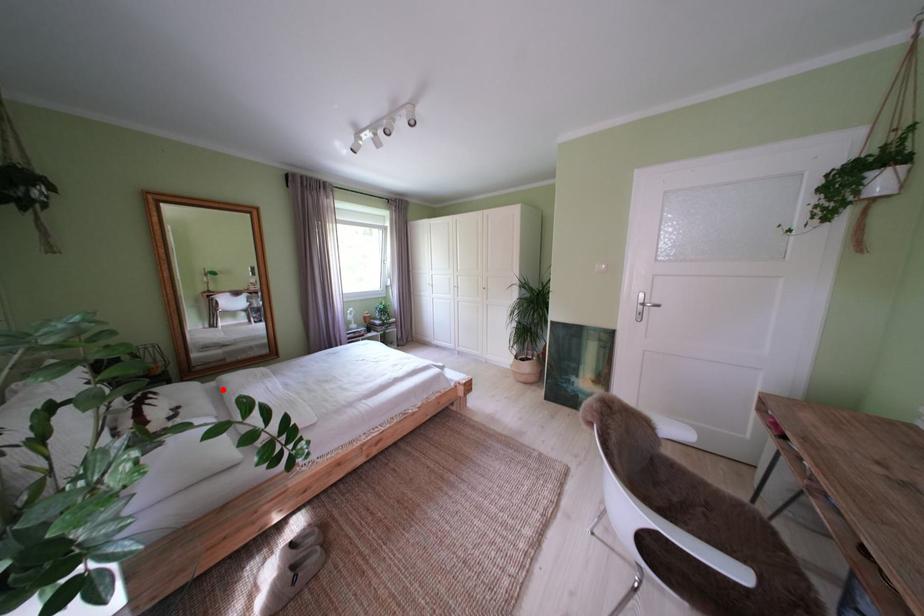
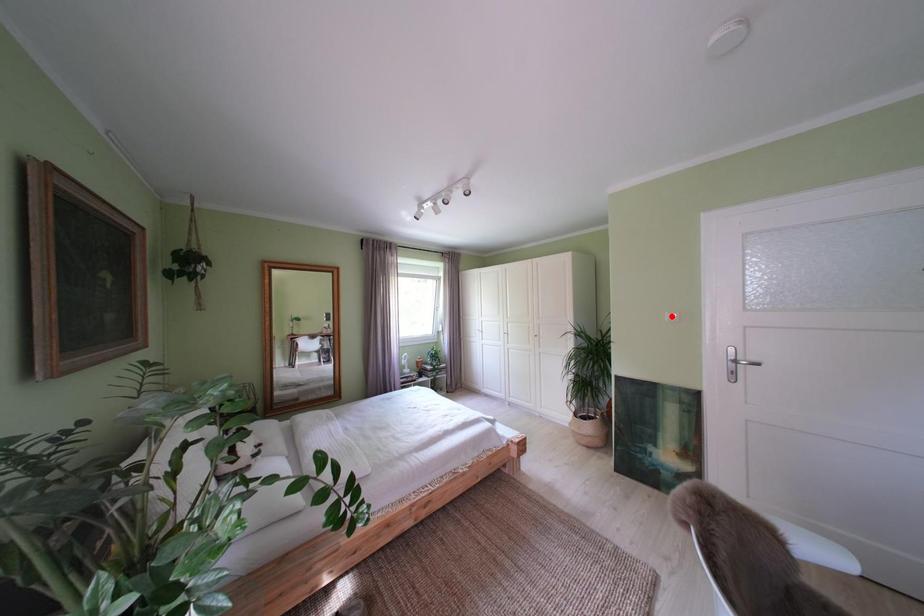
I am providing you with two images of the same scene from different viewpoints. A red point is marked on the first image and another point is marked on the second image. Are the points marked in image1 and image2 representing the same 3D position?

No